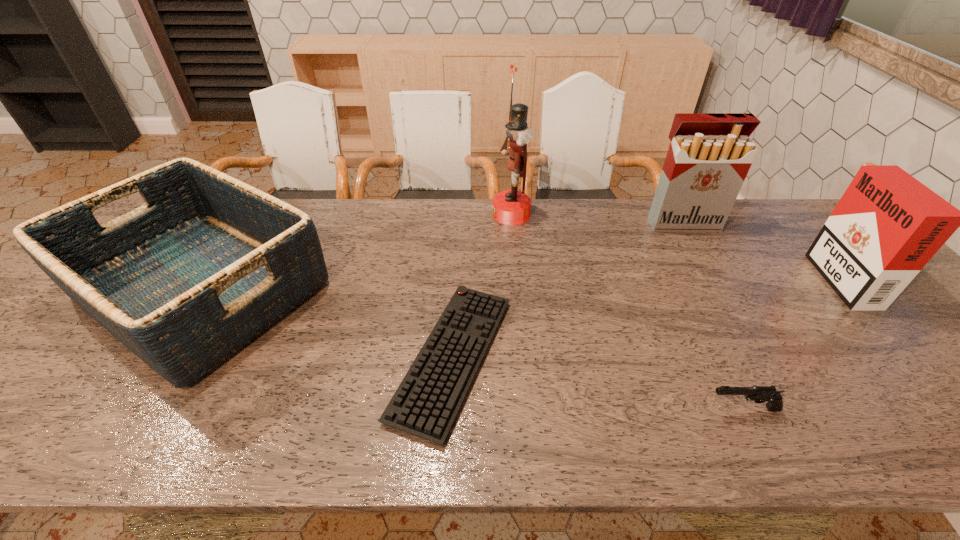
Locate an element on the screen. This screenshot has height=540, width=960. free space between the gun and the left cigarette case is located at coordinates (712, 316).

Where is `free space between the tallest object and the computer keyboard`? This screenshot has height=540, width=960. free space between the tallest object and the computer keyboard is located at coordinates (482, 286).

Image resolution: width=960 pixels, height=540 pixels. I want to click on free area in between the computer keyboard and the gun, so click(x=597, y=383).

In order to click on vacant space that is in between the shorter cigarette case and the farther cigarette case in this screenshot , I will do `click(759, 249)`.

At what (x,y) coordinates should I click in order to perform the action: click on vacant space that's between the computer keyboard and the fourth shortest object. Please return your answer as a coordinate pair (x, y). Looking at the image, I should click on (644, 316).

You are a GUI agent. You are given a task and a screenshot of the screen. Output one action in this format:
    pyautogui.click(x=<x>, y=<y>)
    Task: Click on the object that ranks as the second closest to the computer keyboard
    This screenshot has width=960, height=540.
    Given the screenshot: What is the action you would take?
    pyautogui.click(x=511, y=207)

Identify which object is the fourth closest to the nutcracker. Please provide its 2D coordinates. Your answer should be formatted as a tuple, i.e. [(x, y)], where the tuple contains the x and y coordinates of a point satisfying the conditions above.

[(759, 394)]

Find the location of `vacant space that satisfies the following two spatial constraints: 1. on the front-facing side of the rightmost object; 2. on the front side of the computer keyboard`. vacant space that satisfies the following two spatial constraints: 1. on the front-facing side of the rightmost object; 2. on the front side of the computer keyboard is located at coordinates (909, 357).